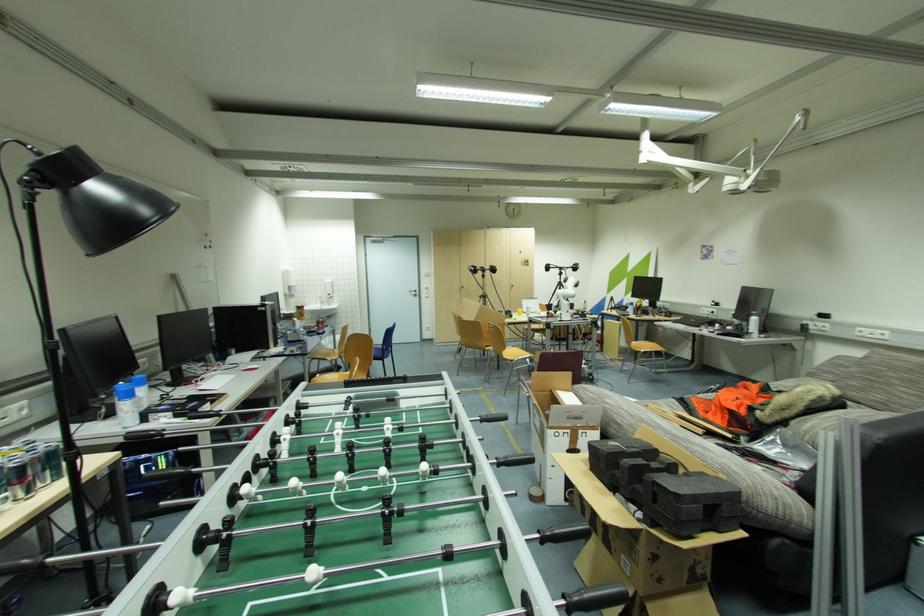
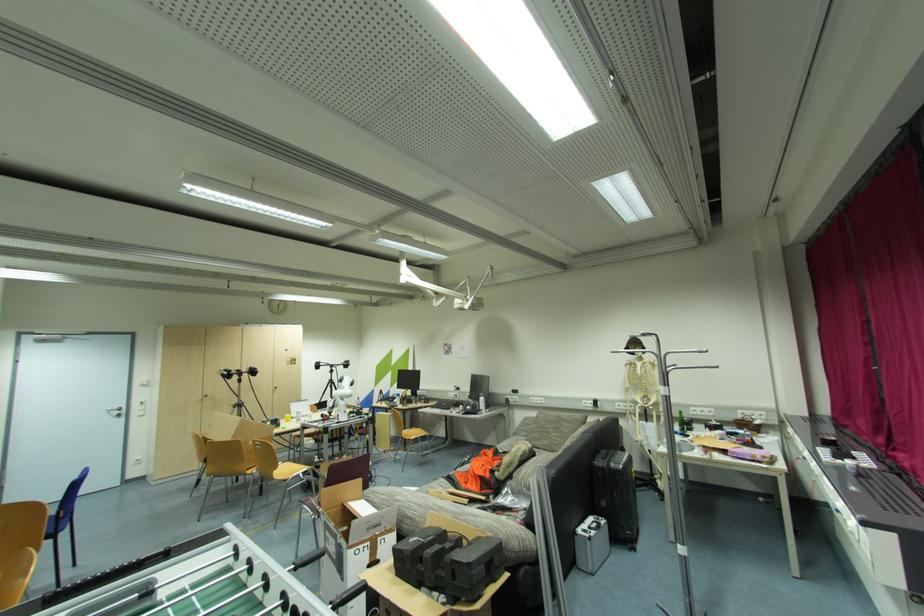
Question: The images are taken continuously from a first-person perspective. In which direction is your viewpoint rotating?

Choices:
 (A) Left
 (B) Right
 (C) Up
 (D) Down

Answer: (B)